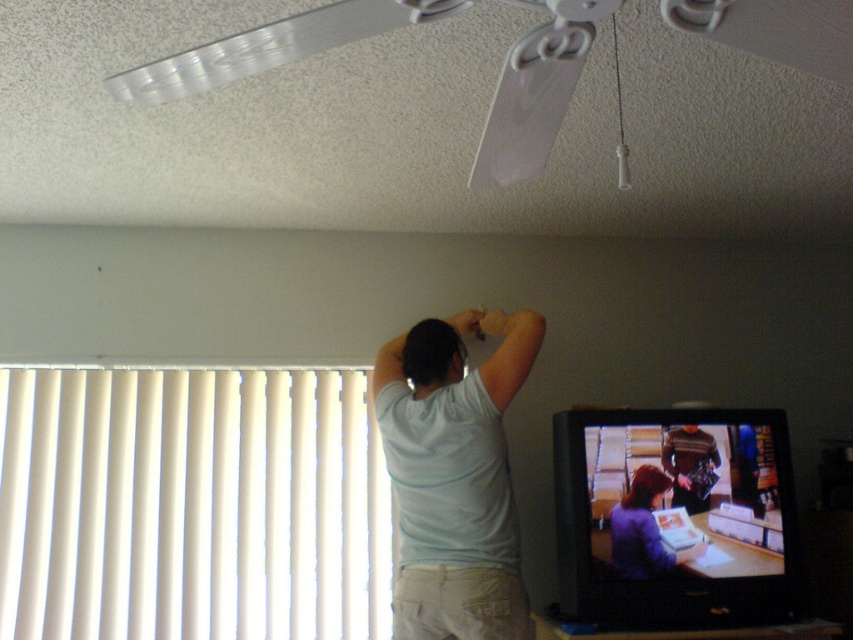
You are trying to decide whether to place a new decorative item on the matte black television at lower right or on the striped sweater at upper right. Based on their sizes, which surface can accommodate a larger item?

The matte black television at lower right has a larger width than the striped sweater at upper right, so it can accommodate a larger item.

You are a delivery person who needs to place a package between the matte black television at lower right and the purple matte shirt at center. The package is 5 inches long. Do you think there is enough space to place it there?

The distance between the matte black television at lower right and the purple matte shirt at center is 4.36 inches, so the package is longer than the available space. It will not fit.